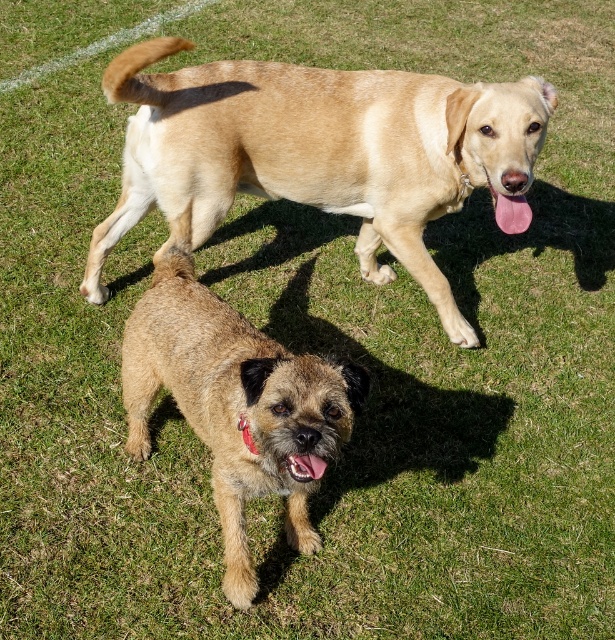
Is light brown fur at upper center to the right of pink glossy tongue at lower center from the viewer's perspective?

No, light brown fur at upper center is not to the right of pink glossy tongue at lower center.

Is light brown fur at upper center shorter than pink glossy tongue at lower center?

No, light brown fur at upper center is not shorter than pink glossy tongue at lower center.

Is point (149, 83) closer to viewer compared to point (290, 456)?

No, it is not.

You are a GUI agent. You are given a task and a screenshot of the screen. Output one action in this format:
    pyautogui.click(x=<x>, y=<y>)
    Task: Click on the light brown fur at upper center
    Image resolution: width=615 pixels, height=640 pixels.
    Given the screenshot: What is the action you would take?
    pyautogui.click(x=322, y=152)

Measure the distance between light brown fur at upper center and camera.

light brown fur at upper center and camera are 2.72 meters apart.

Between point (306, 192) and point (216, 412), which one is positioned behind?

The point (306, 192) is more distant.

In order to click on light brown fur at upper center in this screenshot , I will do `click(322, 152)`.

Between point (244, 452) and point (295, 468), which one is positioned behind?

The point (244, 452) is more distant.

Is brown shaggy dog at center below pink glossy tongue at lower center?

No.

Is point (220, 480) positioned after point (300, 461)?

Yes, point (220, 480) is behind point (300, 461).

You are a GUI agent. You are given a task and a screenshot of the screen. Output one action in this format:
    pyautogui.click(x=<x>, y=<y>)
    Task: Click on the brown shaggy dog at center
    This screenshot has height=640, width=615.
    Given the screenshot: What is the action you would take?
    pyautogui.click(x=234, y=404)